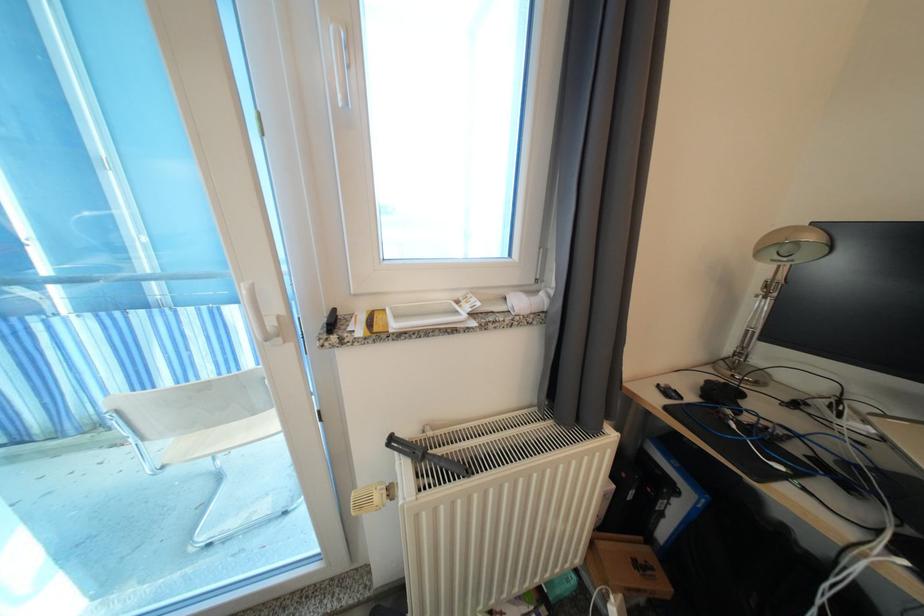
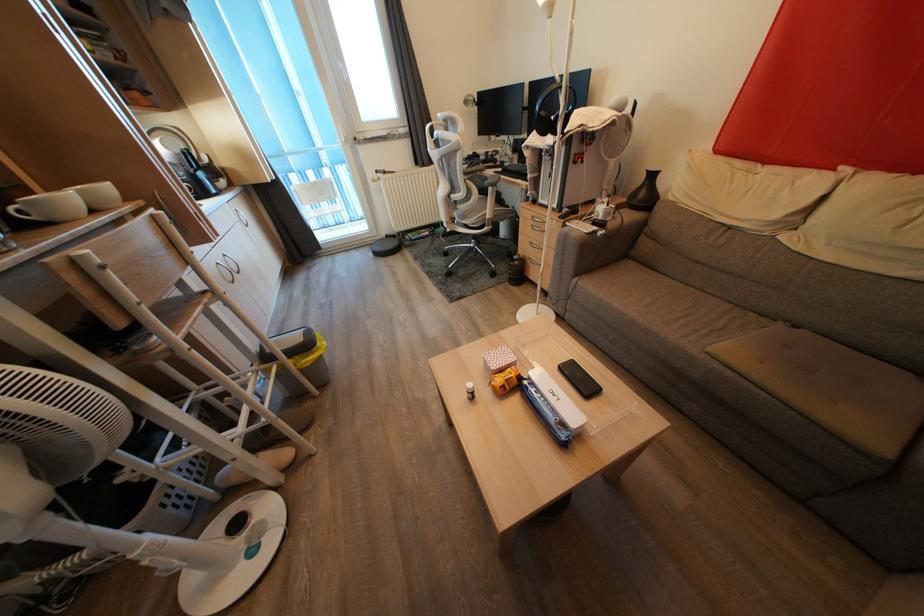
Question: The images are taken continuously from a first-person perspective. In which direction are you moving?

Choices:
 (A) Left
 (B) Right
 (C) Forward
 (D) Backward

Answer: (D)